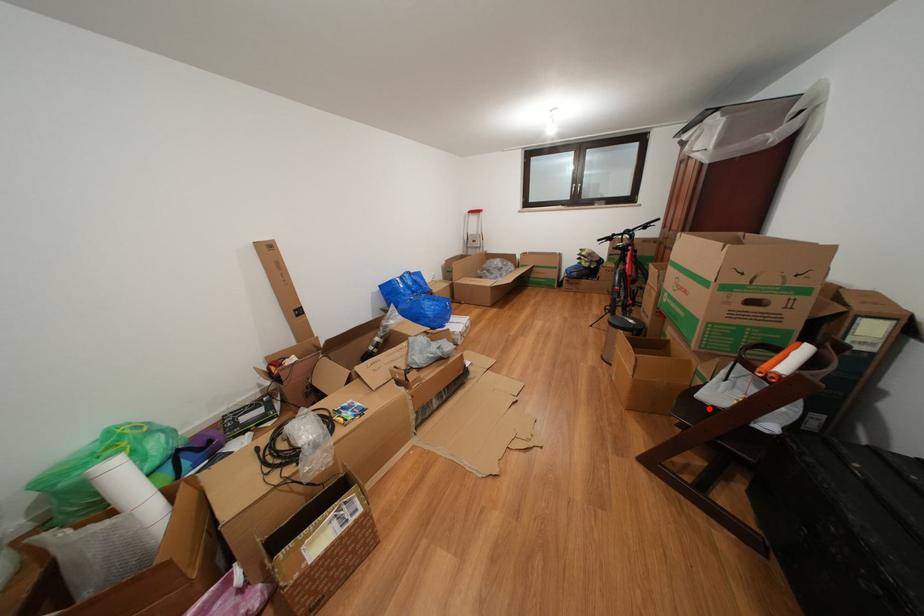
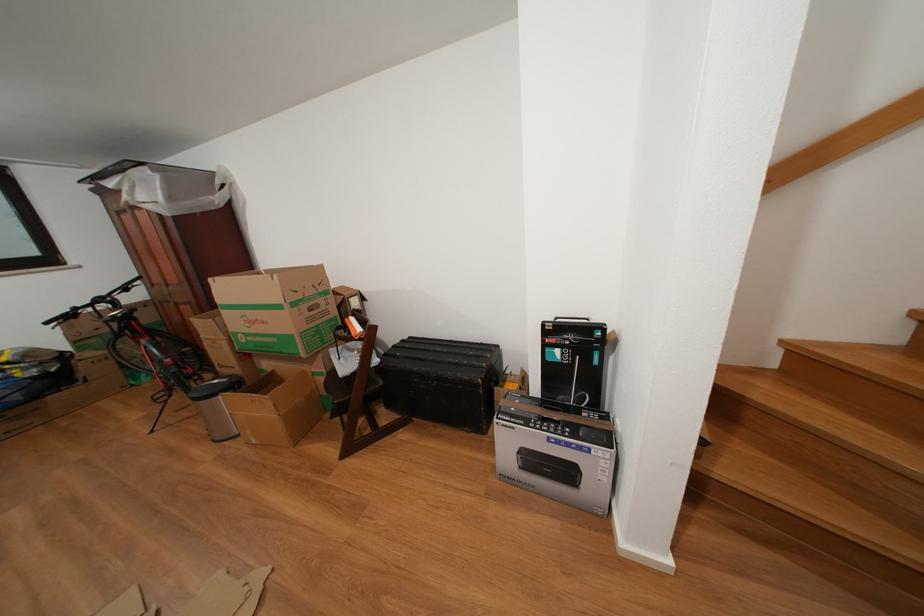
Locate, in the second image, the point that corresponds to the highlighted location in the first image.

(354, 383)